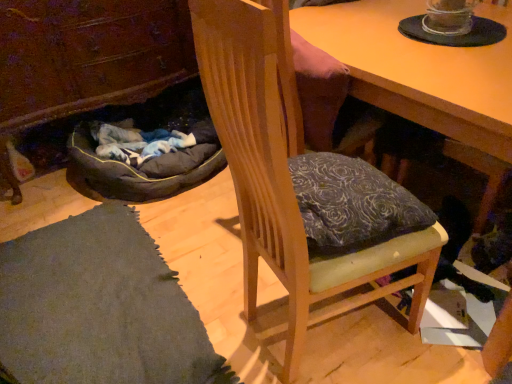
Locate an element on the screen. The width and height of the screenshot is (512, 384). vacant space to the left of wooden chair at center is located at coordinates (224, 307).